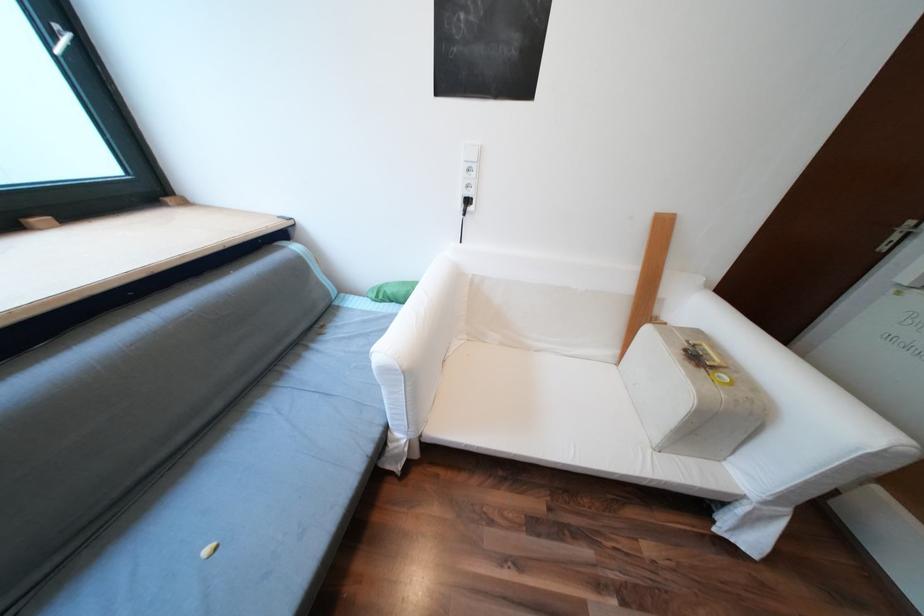
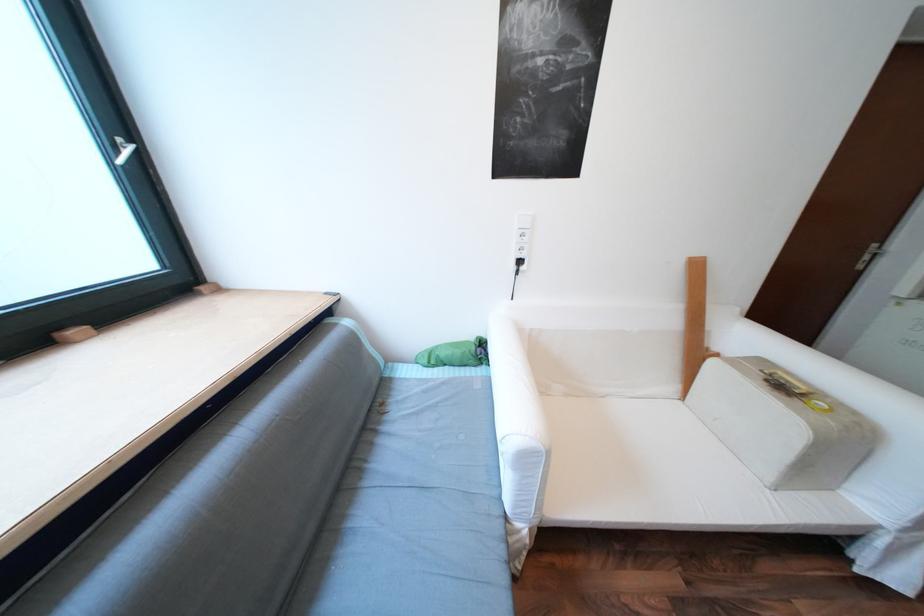
In the second image, find the point that corresponds to [405,422] in the first image.

(528, 511)